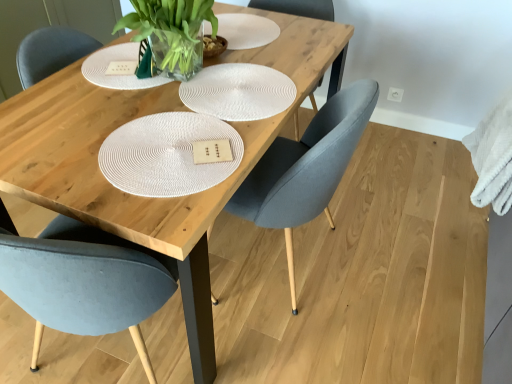
Locate an element on the screen. Image resolution: width=512 pixels, height=384 pixels. empty space that is in between matte gray chair at center, which ranks as the 1th chair in left-to-right order, and wooden table at center is located at coordinates (24, 345).